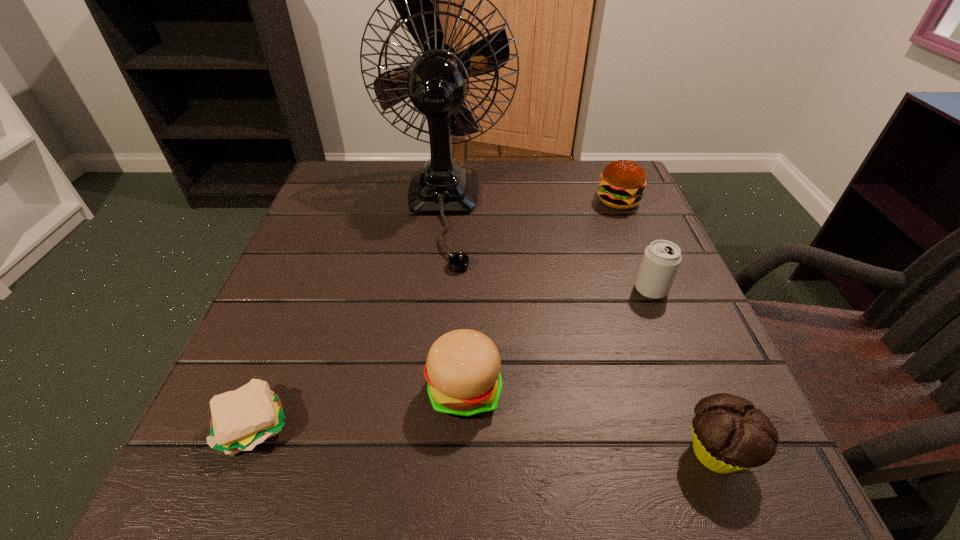
The height and width of the screenshot is (540, 960). Identify the location of fan. (437, 81).

The width and height of the screenshot is (960, 540). Identify the location of the fourth nearest object. (661, 260).

At what (x,y) coordinates should I click in order to perform the action: click on the farther hamburger. Please return your answer as a coordinate pair (x, y). Looking at the image, I should click on (622, 182).

I want to click on the left hamburger, so click(x=463, y=366).

This screenshot has width=960, height=540. In order to click on muffin in this screenshot , I will do `click(729, 434)`.

Image resolution: width=960 pixels, height=540 pixels. Identify the location of the shortest object. (241, 419).

You are a GUI agent. You are given a task and a screenshot of the screen. Output one action in this format:
    pyautogui.click(x=<x>, y=<y>)
    Task: Click on the patty
    This screenshot has height=540, width=960.
    Given the screenshot: What is the action you would take?
    pyautogui.click(x=241, y=419)

This screenshot has height=540, width=960. Find the location of `vacant space located in front of the tallest object, indicating the direction of air flow`. vacant space located in front of the tallest object, indicating the direction of air flow is located at coordinates (420, 411).

Image resolution: width=960 pixels, height=540 pixels. In order to click on vacant space located on the front of the can in this screenshot , I will do `click(689, 386)`.

Find the location of `vacant space situated 0.070m on the front of the farther hamburger`. vacant space situated 0.070m on the front of the farther hamburger is located at coordinates (631, 233).